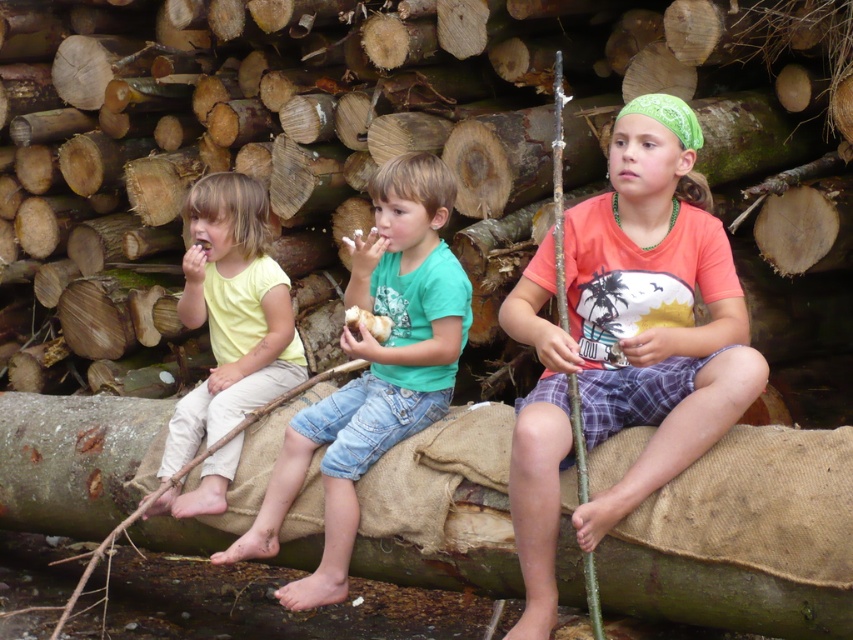
Does green cotton shirt at center have a lesser width compared to brown rough wood at center?

Yes.

Can you confirm if green cotton shirt at center is positioned to the left of brown rough wood at center?

Indeed, green cotton shirt at center is positioned on the left side of brown rough wood at center.

Is point (396, 292) behind point (801, 332)?

No, (396, 292) is closer to viewer.

The image size is (853, 640). In order to click on green cotton shirt at center in this screenshot , I will do `click(374, 369)`.

Between brown rough log at center and light yellow t-shirt at left, which one appears on the right side from the viewer's perspective?

light yellow t-shirt at left is more to the right.

This screenshot has width=853, height=640. What do you see at coordinates (743, 538) in the screenshot?
I see `brown rough log at center` at bounding box center [743, 538].

The image size is (853, 640). In order to click on brown rough log at center in this screenshot , I will do `click(743, 538)`.

I want to click on brown rough log at center, so click(x=743, y=538).

Does orange cotton shirt at center come behind brown rough wood at center?

No, it is not.

Is orange cotton shirt at center taller than brown rough wood at center?

Correct, orange cotton shirt at center is much taller as brown rough wood at center.

What do you see at coordinates (627, 340) in the screenshot? I see `orange cotton shirt at center` at bounding box center [627, 340].

This screenshot has width=853, height=640. What are the coordinates of `orange cotton shirt at center` in the screenshot? It's located at (627, 340).